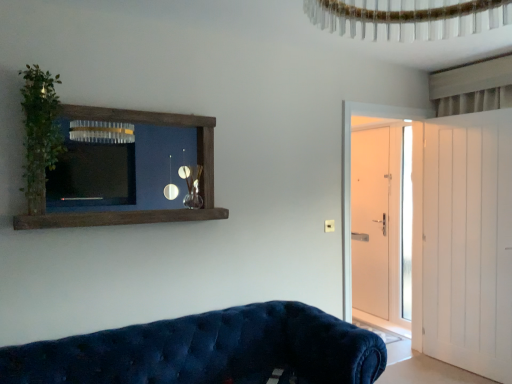
Question: Based on their positions, is brown wooden shelf at upper left located to the left or right of white wooden door at right, the 2th door from the front?

Choices:
 (A) right
 (B) left

Answer: (B)

Question: Looking at their shapes, would you say brown wooden shelf at upper left is wider or thinner than white wooden door at right, the 2th door from the front?

Choices:
 (A) wide
 (B) thin

Answer: (B)

Question: Estimate the real-world distances between objects in this image. Which object is closer to the green leafy plant at left?

Choices:
 (A) brown wooden shelf at upper left
 (B) white smooth door at right, the 1th door from the back
 (C) white wooden door at right, the first door positioned from the front
 (D) white wooden door at right, the 2th door from the front
 (E) velvet blue couch at lower left

Answer: (A)

Question: Considering the real-world distances, which object is farthest from the white wooden door at right, arranged as the 3th door when viewed from the back?

Choices:
 (A) velvet blue couch at lower left
 (B) brown wooden shelf at upper left
 (C) white smooth door at right, the third door from the front
 (D) green leafy plant at left
 (E) white wooden door at right, placed as the second door when sorted from back to front

Answer: (D)